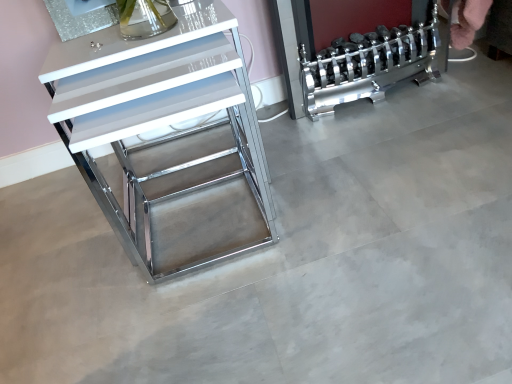
This screenshot has width=512, height=384. I want to click on vacant space in white glossy drawer at left (from a real-world perspective), so click(196, 181).